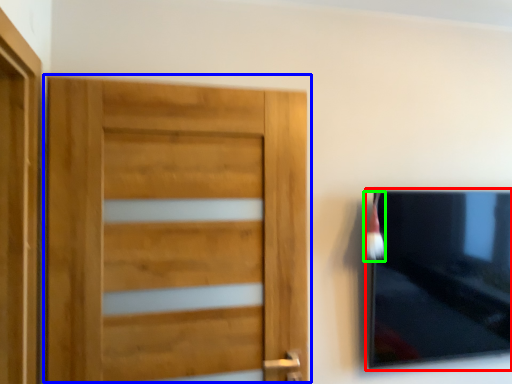
Question: Which object is the closest to the picture frame (highlighted by a red box)? Choose among these: door (highlighted by a blue box) or brush (highlighted by a green box).

Choices:
 (A) door
 (B) brush

Answer: (B)